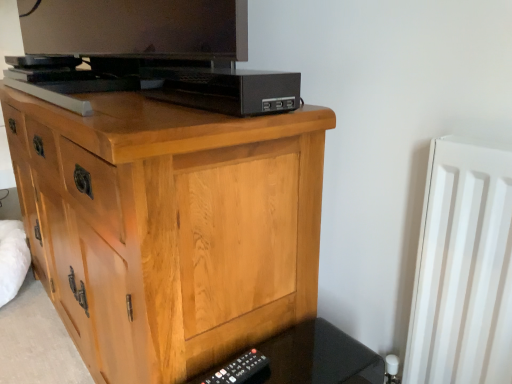
Question: From the image's perspective, is black plastic remote at lower right above black plastic remote at lower right?

Choices:
 (A) yes
 (B) no

Answer: (A)

Question: Can you confirm if black plastic remote at lower right is wider than black plastic remote at lower right?

Choices:
 (A) yes
 (B) no

Answer: (B)

Question: Does black plastic remote at lower right have a smaller size compared to black plastic remote at lower right?

Choices:
 (A) yes
 (B) no

Answer: (A)

Question: Considering the relative sizes of black plastic remote at lower right and black plastic remote at lower right in the image provided, is black plastic remote at lower right thinner than black plastic remote at lower right?

Choices:
 (A) no
 (B) yes

Answer: (B)

Question: Is black plastic remote at lower right completely or partially inside black plastic remote at lower right?

Choices:
 (A) no
 (B) yes

Answer: (A)

Question: Choose the correct answer: Is black plastic remote at lower right inside black plastic usb hub at upper center or outside it?

Choices:
 (A) inside
 (B) outside

Answer: (B)

Question: In terms of height, does black plastic remote at lower right look taller or shorter compared to black plastic usb hub at upper center?

Choices:
 (A) tall
 (B) short

Answer: (B)

Question: Visually, is black plastic remote at lower right positioned to the left or to the right of black plastic usb hub at upper center?

Choices:
 (A) right
 (B) left

Answer: (A)

Question: In the image, is black plastic remote at lower right positioned in front of or behind black plastic usb hub at upper center?

Choices:
 (A) behind
 (B) front

Answer: (B)

Question: In terms of size, does black plastic remote at lower right appear bigger or smaller than light wood chest of drawers at center?

Choices:
 (A) big
 (B) small

Answer: (B)

Question: Relative to light wood chest of drawers at center, is black plastic remote at lower right in front or behind?

Choices:
 (A) behind
 (B) front

Answer: (A)

Question: Choose the correct answer: Is black plastic remote at lower right inside light wood chest of drawers at center or outside it?

Choices:
 (A) outside
 (B) inside

Answer: (A)

Question: From a real-world perspective, relative to light wood chest of drawers at center, is black plastic remote at lower right vertically above or below?

Choices:
 (A) above
 (B) below

Answer: (B)

Question: Considering the positions of black plastic remote at lower right and black plastic remote at lower right in the image, is black plastic remote at lower right taller or shorter than black plastic remote at lower right?

Choices:
 (A) short
 (B) tall

Answer: (A)

Question: Does point (214, 379) appear closer or farther from the camera than point (314, 370)?

Choices:
 (A) closer
 (B) farther

Answer: (A)